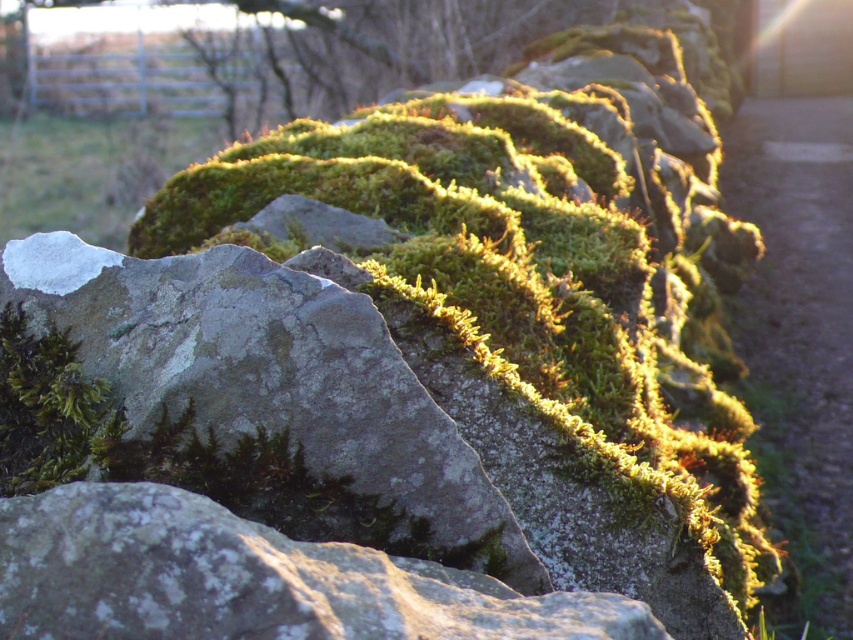
You are a geologist examining the stone wall and notice two green mossy rocks. Which one has a smaller width between the green mossy rock at center and the green mossy rock at upper center?

The green mossy rock at center is thinner than the green mossy rock at upper center, so the green mossy rock at center has a smaller width.

You are a photographer trying to capture the texture of the stone wall. You notice two points on the wall at coordinates point [494,429] and point [358,97]. Which point should you focus on to ensure the texture is most prominent in your photo?

Point [494,429] is closer to the camera than point [358,97], so focusing on point [494,429] will ensure the texture is most prominent in your photo.

Looking at the stone wall with green moss, you notice two green mossy rocks. Which one has a greater width between the green mossy rock at upper center and the green mossy rock at upper left?

The green mossy rock at upper center has a greater width than the green mossy rock at upper left.